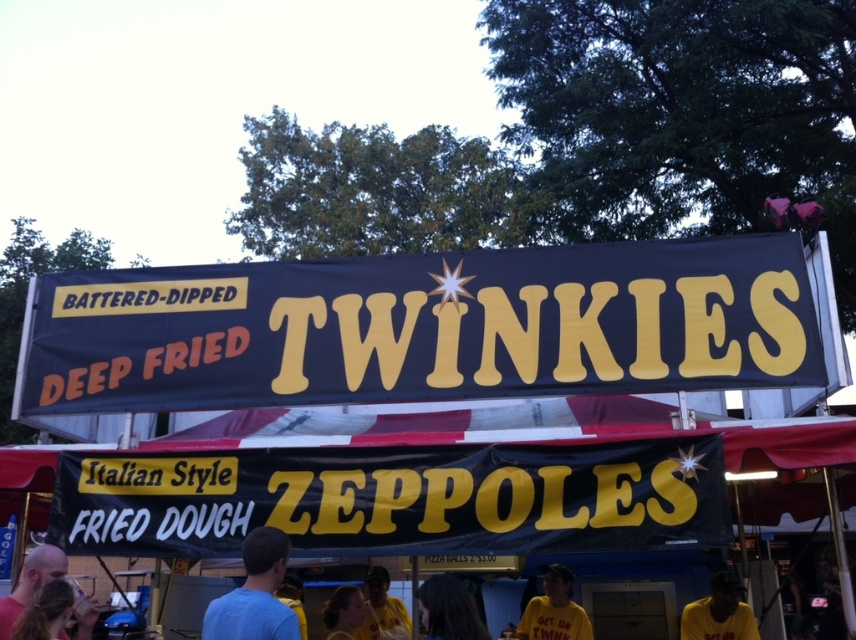
Between dark brown hair at lower center and yellow shirt at center, which one appears on the left side from the viewer's perspective?

yellow shirt at center

What do you see at coordinates (449, 609) in the screenshot?
I see `dark brown hair at lower center` at bounding box center [449, 609].

The image size is (856, 640). I want to click on dark brown hair at lower center, so click(x=449, y=609).

Does blue shirt at center have a lesser width compared to yellow shirt at center?

No.

Between point (223, 634) and point (387, 600), which one is positioned in front?

Point (223, 634) is more forward.

What are the coordinates of `blue shirt at center` in the screenshot? It's located at (254, 595).

Can you confirm if blue fabric signboard at center is positioned to the right of yellow fabric shirt at lower center?

In fact, blue fabric signboard at center is to the left of yellow fabric shirt at lower center.

Locate an element on the screen. blue fabric signboard at center is located at coordinates (425, 326).

Does point (629, 369) lie behind point (516, 637)?

No, it is in front of (516, 637).

Locate an element on the screen. The image size is (856, 640). blue fabric signboard at center is located at coordinates (425, 326).